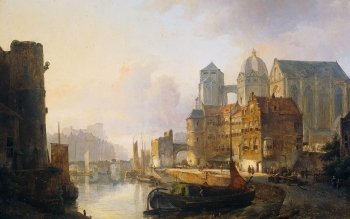
Where is `windows`? The image size is (350, 219). windows is located at coordinates (256, 144), (246, 147), (258, 122), (252, 124), (247, 124).